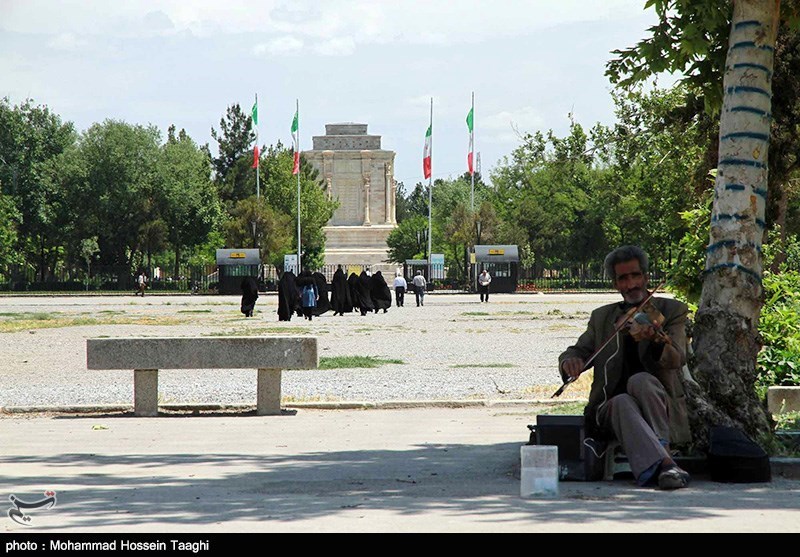
At what (x,y) coordinates should I click in order to perform the action: click on bench. Please return your answer as a coordinate pair (x, y). The height and width of the screenshot is (557, 800). Looking at the image, I should click on (161, 364), (266, 354).